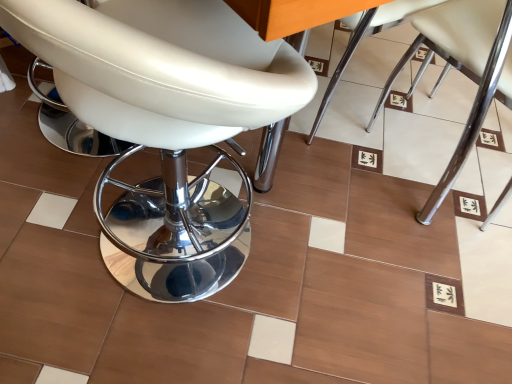
Where is `white leather chair at center, the 1th chair viewed from the right`? white leather chair at center, the 1th chair viewed from the right is located at coordinates (463, 70).

Identify the location of white leather chair at center, which ranks as the second chair in left-to-right order. Image resolution: width=512 pixels, height=384 pixels. (362, 35).

Between white leather stool at left, which appears as the third chair when viewed from the right, and white leather chair at center, which ranks as the second chair in left-to-right order, which one appears on the right side from the viewer's perspective?

From the viewer's perspective, white leather chair at center, which ranks as the second chair in left-to-right order, appears more on the right side.

Which of these two, white leather stool at left, which appears as the first chair when viewed from the left, or white leather chair at center, which ranks as the second chair in left-to-right order, is wider?

Wider between the two is white leather stool at left, which appears as the first chair when viewed from the left.

Is the position of white leather stool at left, which appears as the third chair when viewed from the right, less distant than that of white leather chair at center, acting as the 2th chair starting from the right?

Yes, white leather stool at left, which appears as the third chair when viewed from the right, is in front of white leather chair at center, acting as the 2th chair starting from the right.

Is white leather stool at left, which appears as the first chair when viewed from the left, not close to white leather chair at center, acting as the 2th chair starting from the right?

No, white leather stool at left, which appears as the first chair when viewed from the left, is in close proximity to white leather chair at center, acting as the 2th chair starting from the right.

From a real-world perspective, which object stands above the other?

From a 3D spatial view, white leather chair at center, the 1th chair viewed from the right, is above.

Considering the positions of objects white leather chair at center, acting as the 2th chair starting from the right, and white leather chair at center, positioned as the 3th chair in left-to-right order, in the image provided, who is behind, white leather chair at center, acting as the 2th chair starting from the right, or white leather chair at center, positioned as the 3th chair in left-to-right order,?

white leather chair at center, acting as the 2th chair starting from the right, is behind.

Is white leather chair at center, which ranks as the second chair in left-to-right order, oriented towards white leather chair at center, the 1th chair viewed from the right?

No, white leather chair at center, which ranks as the second chair in left-to-right order, is not facing towards white leather chair at center, the 1th chair viewed from the right.

In the scene shown: Does white leather chair at center, the 1th chair viewed from the right, turn towards white leather stool at left, which appears as the third chair when viewed from the right?

No, white leather chair at center, the 1th chair viewed from the right, is not turned towards white leather stool at left, which appears as the third chair when viewed from the right.

From a real-world perspective, which object rests below the other?

white leather chair at center, positioned as the 3th chair in left-to-right order, from a real-world perspective.

Is white leather chair at center, the 1th chair viewed from the right, in front of or behind white leather stool at left, which appears as the third chair when viewed from the right, in the image?

In the image, white leather chair at center, the 1th chair viewed from the right, appears behind white leather stool at left, which appears as the third chair when viewed from the right.

From the image's perspective, does white leather chair at center, positioned as the 3th chair in left-to-right order, appear higher than white leather chair at center, acting as the 2th chair starting from the right?

Actually, white leather chair at center, positioned as the 3th chair in left-to-right order, appears below white leather chair at center, acting as the 2th chair starting from the right, in the image.

From a real-world perspective, is white leather chair at center, positioned as the 3th chair in left-to-right order, above or below white leather chair at center, acting as the 2th chair starting from the right?

From a real-world perspective, white leather chair at center, positioned as the 3th chair in left-to-right order, is physically above white leather chair at center, acting as the 2th chair starting from the right.

Is white leather chair at center, the 1th chair viewed from the right, wider or thinner than white leather chair at center, which ranks as the second chair in left-to-right order?

In the image, white leather chair at center, the 1th chair viewed from the right, appears to be wider than white leather chair at center, which ranks as the second chair in left-to-right order.

Is white leather chair at center, positioned as the 3th chair in left-to-right order, positioned beyond the bounds of white leather chair at center, which ranks as the second chair in left-to-right order?

That's correct, white leather chair at center, positioned as the 3th chair in left-to-right order, is outside of white leather chair at center, which ranks as the second chair in left-to-right order.

Could you tell me if white leather stool at left, which appears as the first chair when viewed from the left, is turned towards white leather chair at center, positioned as the 3th chair in left-to-right order?

Yes.

From the image's perspective, is white leather stool at left, which appears as the third chair when viewed from the right, on white leather chair at center, the 1th chair viewed from the right?

Actually, white leather stool at left, which appears as the third chair when viewed from the right, appears below white leather chair at center, the 1th chair viewed from the right, in the image.

Does white leather stool at left, which appears as the first chair when viewed from the left, lie in front of white leather chair at center, the 1th chair viewed from the right?

Yes, it is.

Is white leather stool at left, which appears as the first chair when viewed from the left, located within white leather chair at center, acting as the 2th chair starting from the right?

No, white leather chair at center, acting as the 2th chair starting from the right, does not contain white leather stool at left, which appears as the first chair when viewed from the left.

From the image's perspective, would you say white leather chair at center, acting as the 2th chair starting from the right, is positioned over white leather stool at left, which appears as the third chair when viewed from the right?

Correct, white leather chair at center, acting as the 2th chair starting from the right, appears higher than white leather stool at left, which appears as the third chair when viewed from the right, in the image.

Is white leather chair at center, which ranks as the second chair in left-to-right order, not close to white leather stool at left, which appears as the third chair when viewed from the right?

No, there isn't a large distance between white leather chair at center, which ranks as the second chair in left-to-right order, and white leather stool at left, which appears as the third chair when viewed from the right.

Identify the location of chair on the left of white leather chair at center, which ranks as the second chair in left-to-right order. (166, 123).

The height and width of the screenshot is (384, 512). Find the location of `chair to the right of white leather chair at center, acting as the 2th chair starting from the right`. chair to the right of white leather chair at center, acting as the 2th chair starting from the right is located at coordinates (463, 70).

Considering their positions, is white leather chair at center, which ranks as the second chair in left-to-right order, positioned further to white leather stool at left, which appears as the third chair when viewed from the right, than white leather chair at center, positioned as the 3th chair in left-to-right order?

Based on the image, white leather chair at center, positioned as the 3th chair in left-to-right order, appears to be further to white leather stool at left, which appears as the third chair when viewed from the right.

Considering their positions, is white leather chair at center, which ranks as the second chair in left-to-right order, positioned closer to white leather chair at center, the 1th chair viewed from the right, than white leather stool at left, which appears as the first chair when viewed from the left?

white leather chair at center, which ranks as the second chair in left-to-right order, is positioned closer to the anchor white leather chair at center, the 1th chair viewed from the right.

Considering their positions, is white leather chair at center, the 1th chair viewed from the right, positioned closer to white leather chair at center, which ranks as the second chair in left-to-right order, than white leather stool at left, which appears as the first chair when viewed from the left?

white leather chair at center, the 1th chair viewed from the right.

From the image, which object appears to be farther from white leather chair at center, the 1th chair viewed from the right, white leather stool at left, which appears as the third chair when viewed from the right, or white leather chair at center, acting as the 2th chair starting from the right?

white leather stool at left, which appears as the third chair when viewed from the right, is positioned further to the anchor white leather chair at center, the 1th chair viewed from the right.

When comparing their distances from white leather chair at center, which ranks as the second chair in left-to-right order, does white leather stool at left, which appears as the third chair when viewed from the right, or white leather chair at center, the 1th chair viewed from the right, seem closer?

Among the two, white leather chair at center, the 1th chair viewed from the right, is located nearer to white leather chair at center, which ranks as the second chair in left-to-right order.

From the image, which object appears to be farther from white leather stool at left, which appears as the third chair when viewed from the right, white leather chair at center, the 1th chair viewed from the right, or white leather chair at center, acting as the 2th chair starting from the right?

The object further to white leather stool at left, which appears as the third chair when viewed from the right, is white leather chair at center, the 1th chair viewed from the right.

I want to click on chair between white leather stool at left, which appears as the third chair when viewed from the right, and white leather chair at center, positioned as the 3th chair in left-to-right order, in the horizontal direction, so click(x=362, y=35).